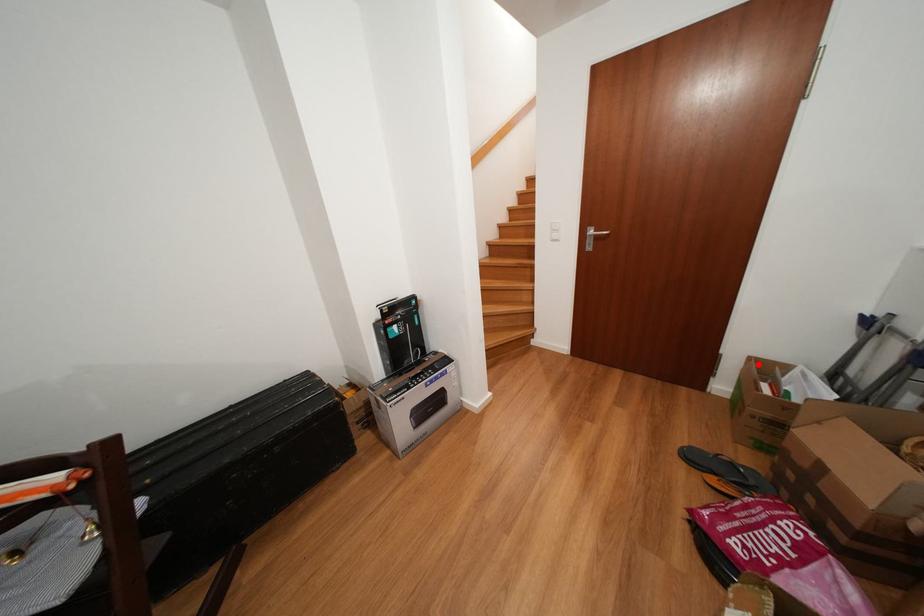
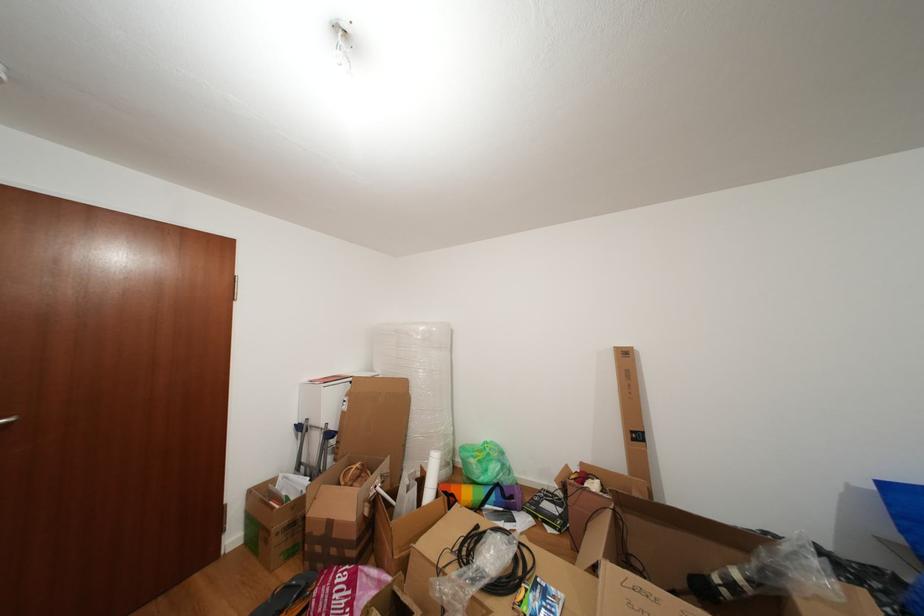
In the second image, find the point that corresponds to the highlighted location in the first image.

(259, 496)